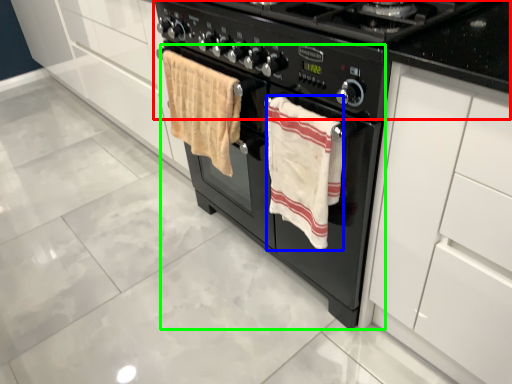
Question: Which is nearer to the gas stove (highlighted by a red box)? beach towel (highlighted by a blue box) or oven (highlighted by a green box).

Choices:
 (A) beach towel
 (B) oven

Answer: (A)